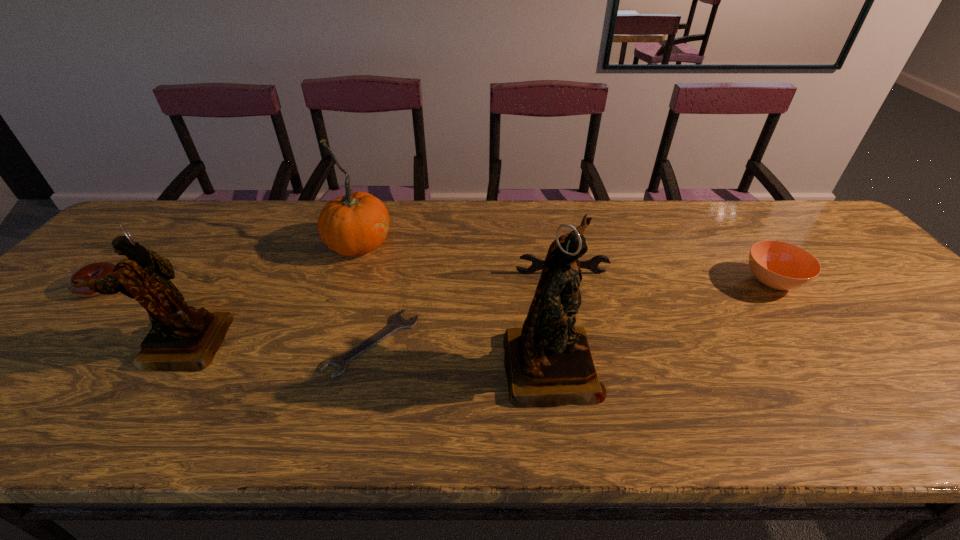
In order to click on vacant space located on the back of the leftmost object in this screenshot , I will do `click(169, 215)`.

In order to click on vacant space situated on the back of the nearer wrench in this screenshot , I will do `click(401, 222)`.

Identify the location of object located at the far edge. (357, 223).

At what (x,y) coordinates should I click in order to perform the action: click on wrench at the near edge. Please return your answer as a coordinate pair (x, y). The width and height of the screenshot is (960, 540). Looking at the image, I should click on (398, 323).

Locate an element on the screen. object at the left edge is located at coordinates (100, 269).

This screenshot has width=960, height=540. In order to click on free space at the far edge in this screenshot , I will do `click(258, 207)`.

Locate an element on the screen. The height and width of the screenshot is (540, 960). vacant space at the near edge is located at coordinates (367, 374).

Identify the location of blank space at the left edge. This screenshot has height=540, width=960. (89, 321).

At what (x,y) coordinates should I click in order to perform the action: click on blank space at the right edge of the desktop. Please return your answer as a coordinate pair (x, y). This screenshot has width=960, height=540. Looking at the image, I should click on (891, 321).

You are a GUI agent. You are given a task and a screenshot of the screen. Output one action in this format:
    pyautogui.click(x=<x>, y=<y>)
    Task: Click on the vacant space at the far left corner
    The height and width of the screenshot is (540, 960).
    Given the screenshot: What is the action you would take?
    pyautogui.click(x=180, y=226)